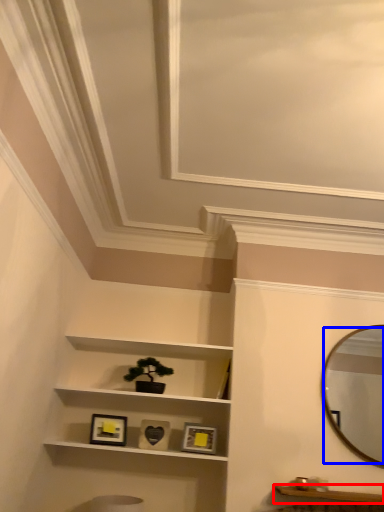
Question: Among these objects, which one is farthest to the camera, cabinetry (highlighted by a red box) or mirror (highlighted by a blue box)?

Choices:
 (A) cabinetry
 (B) mirror

Answer: (B)